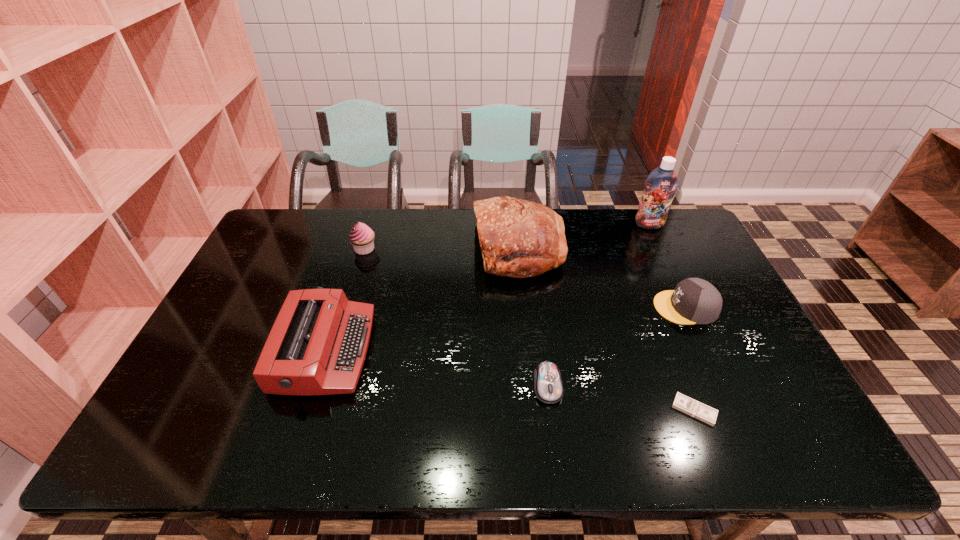
Image resolution: width=960 pixels, height=540 pixels. Identify the location of vacant space located 0.200m at the sliced front of the sixth shortest object. (415, 249).

Identify the location of vacant region located on the left of the fifth shortest object. (287, 249).

What are the coordinates of `free space located 0.130m on the typing side of the fourth tallest object` in the screenshot? It's located at (418, 350).

Locate an element on the screen. vacant space positioned on the front-facing side of the cap is located at coordinates (542, 307).

Locate an element on the screen. vacant space located on the front-facing side of the cap is located at coordinates (569, 307).

Find the location of `blank space located on the front-facing side of the cap`. blank space located on the front-facing side of the cap is located at coordinates (563, 307).

The width and height of the screenshot is (960, 540). Find the location of `free location located 0.130m on the wheel side of the second shortest object`. free location located 0.130m on the wheel side of the second shortest object is located at coordinates (557, 458).

This screenshot has height=540, width=960. Identify the location of vacant space located 0.220m on the back of the shortest object. (661, 326).

Find the location of a particular element. shampoo situated at the far edge is located at coordinates (660, 186).

What are the coordinates of `bread that is at the far edge` in the screenshot? It's located at (518, 238).